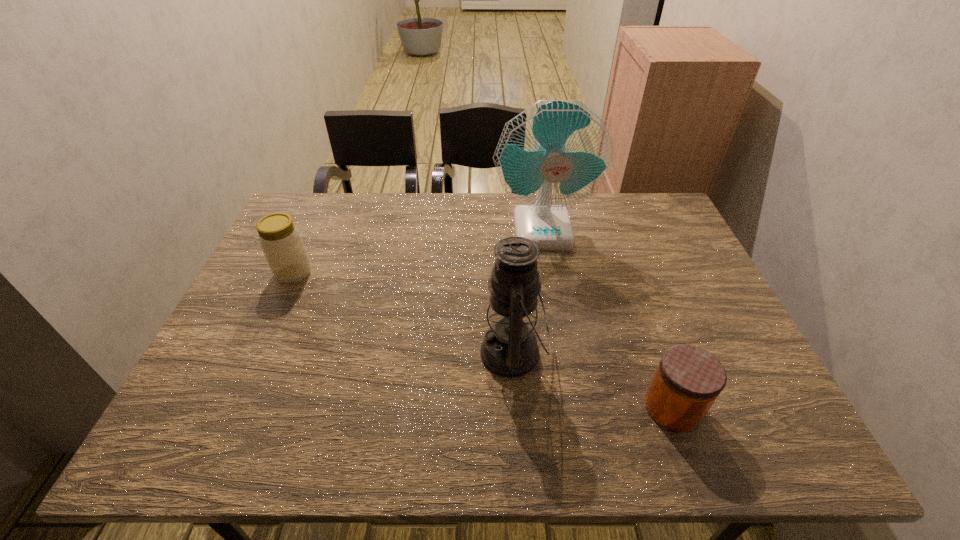
Find the location of a particular element. This screenshot has height=540, width=960. vacant region that satisfies the following two spatial constraints: 1. in front of the fan to face the airflow; 2. on the left side of the shorter jar is located at coordinates (573, 408).